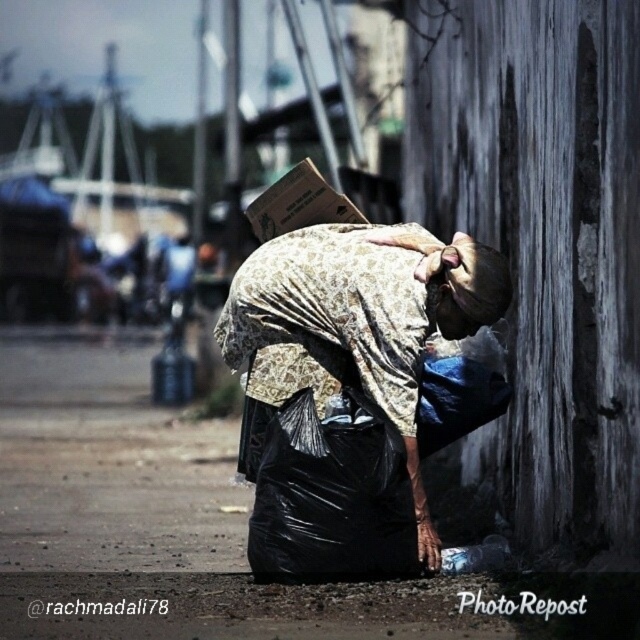
You are standing at the center of the image and want to place a new object exactly where the printed fabric bag at lower center is located. What are the coordinates of the point where you should place the new object?

The coordinates for the printed fabric bag at lower center are at point (358, 320).

You are a delivery person who needs to place both the printed fabric bag at lower center and the brown woven hat at center on a shelf. The shelf has limited depth. Based on their positions, which item should you place first to ensure they both fit on the shelf?

The printed fabric bag at lower center is closer to the viewer than the brown woven hat at center, so you should place the printed fabric bag at lower center first to make space for the brown woven hat at center further back on the shelf.

You are a delivery person who needs to carefully move the brown cardboard box at center to a storage area 5 meters away. The brown woven hat at center is currently blocking the path. Can you move the box without moving the hat?

The brown woven hat at center is 3.34 meters away from the brown cardboard box at center, so there is enough space between them to move the box 5 meters without needing to move the hat.